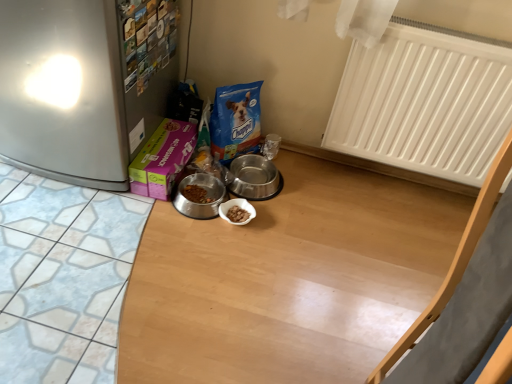
The height and width of the screenshot is (384, 512). What do you see at coordinates (207, 196) in the screenshot?
I see `metallic silver bowl at center, which is the 2th appliance from right to left` at bounding box center [207, 196].

Where is `matte purple box at center-left`? Image resolution: width=512 pixels, height=384 pixels. matte purple box at center-left is located at coordinates (162, 159).

The width and height of the screenshot is (512, 384). What do you see at coordinates (84, 85) in the screenshot?
I see `brushed metal fridge at left` at bounding box center [84, 85].

Image resolution: width=512 pixels, height=384 pixels. I want to click on brushed metal fridge at left, so click(x=84, y=85).

This screenshot has width=512, height=384. I want to click on white matte radiator at upper right, so click(x=424, y=102).

The image size is (512, 384). In order to click on metallic stainless steel bowl at center, which appears as the first appliance when viewed from the right in this screenshot , I will do `click(254, 177)`.

The width and height of the screenshot is (512, 384). I want to click on metallic silver bowl at center, which is the 2th appliance from right to left, so click(207, 196).

Is brushed metal fridge at left oriented towards white matte radiator at upper right?

No, brushed metal fridge at left does not turn towards white matte radiator at upper right.

Does brushed metal fridge at left have a lesser width compared to white matte radiator at upper right?

No, brushed metal fridge at left is not thinner than white matte radiator at upper right.

Considering the relative positions of brushed metal fridge at left and white matte radiator at upper right in the image provided, is brushed metal fridge at left behind white matte radiator at upper right?

No, it is in front of white matte radiator at upper right.

From the image's perspective, is brushed metal fridge at left beneath white matte radiator at upper right?

No, from the image's perspective, brushed metal fridge at left is not below white matte radiator at upper right.

Can you confirm if white matte radiator at upper right is positioned to the right of metallic stainless steel bowl at center, positioned as the 2th appliance in left-to-right order?

Correct, you'll find white matte radiator at upper right to the right of metallic stainless steel bowl at center, positioned as the 2th appliance in left-to-right order.

Considering the sizes of white matte radiator at upper right and metallic stainless steel bowl at center, which appears as the first appliance when viewed from the right, in the image, is white matte radiator at upper right wider or thinner than metallic stainless steel bowl at center, which appears as the first appliance when viewed from the right,?

In the image, white matte radiator at upper right appears to be more narrow than metallic stainless steel bowl at center, which appears as the first appliance when viewed from the right.

From a real-world perspective, between white matte radiator at upper right and metallic stainless steel bowl at center, which appears as the first appliance when viewed from the right, who is vertically higher?

From a 3D spatial view, white matte radiator at upper right is above.

Is white matte radiator at upper right touching metallic stainless steel bowl at center, which appears as the first appliance when viewed from the right?

No, white matte radiator at upper right is not with metallic stainless steel bowl at center, which appears as the first appliance when viewed from the right.

Is white matte radiator at upper right taller than metallic silver bowl at center, which is the 2th appliance from right to left?

Yes, white matte radiator at upper right is taller than metallic silver bowl at center, which is the 2th appliance from right to left.

Is point (384, 46) closer to viewer compared to point (204, 181)?

Yes, point (384, 46) is closer to viewer.

Considering the relative sizes of white matte radiator at upper right and metallic silver bowl at center, the 1th appliance viewed from the left, in the image provided, is white matte radiator at upper right bigger than metallic silver bowl at center, the 1th appliance viewed from the left,?

Indeed, white matte radiator at upper right has a larger size compared to metallic silver bowl at center, the 1th appliance viewed from the left.

Consider the image. In terms of height, does matte purple box at center-left look taller or shorter compared to metallic stainless steel bowl at center, which appears as the first appliance when viewed from the right?

matte purple box at center-left is taller than metallic stainless steel bowl at center, which appears as the first appliance when viewed from the right.

Looking at this image, considering the sizes of matte purple box at center-left and metallic stainless steel bowl at center, positioned as the 2th appliance in left-to-right order, in the image, is matte purple box at center-left wider or thinner than metallic stainless steel bowl at center, positioned as the 2th appliance in left-to-right order,?

Clearly, matte purple box at center-left has more width compared to metallic stainless steel bowl at center, positioned as the 2th appliance in left-to-right order.

Based on the photo, considering the relative sizes of matte purple box at center-left and metallic stainless steel bowl at center, which appears as the first appliance when viewed from the right, in the image provided, is matte purple box at center-left smaller than metallic stainless steel bowl at center, which appears as the first appliance when viewed from the right,?

Incorrect, matte purple box at center-left is not smaller in size than metallic stainless steel bowl at center, which appears as the first appliance when viewed from the right.

Is matte purple box at center-left inside or outside of metallic stainless steel bowl at center, positioned as the 2th appliance in left-to-right order?

matte purple box at center-left is spatially situated outside metallic stainless steel bowl at center, positioned as the 2th appliance in left-to-right order.

Is metallic silver bowl at center, which is the 2th appliance from right to left, facing towards white matte radiator at upper right?

No.

Is metallic silver bowl at center, which is the 2th appliance from right to left, behind white matte radiator at upper right?

Yes, the depth of metallic silver bowl at center, which is the 2th appliance from right to left, is greater than that of white matte radiator at upper right.

From the image's perspective, between metallic silver bowl at center, which is the 2th appliance from right to left, and white matte radiator at upper right, which one is located above?

white matte radiator at upper right.

Between metallic silver bowl at center, the 1th appliance viewed from the left, and white matte radiator at upper right, which one appears on the right side from the viewer's perspective?

Positioned to the right is white matte radiator at upper right.

Is white matte radiator at upper right oriented away from brushed metal fridge at left?

That's not correct — white matte radiator at upper right is not looking away from brushed metal fridge at left.

In the scene shown: Considering the relative sizes of white matte radiator at upper right and brushed metal fridge at left in the image provided, is white matte radiator at upper right thinner than brushed metal fridge at left?

Correct, the width of white matte radiator at upper right is less than that of brushed metal fridge at left.

What are the coordinates of `radiator behind the brushed metal fridge at left` in the screenshot? It's located at (424, 102).

Looking at this image, considering the relative sizes of metallic silver bowl at center, the 1th appliance viewed from the left, and brushed metal fridge at left in the image provided, is metallic silver bowl at center, the 1th appliance viewed from the left, smaller than brushed metal fridge at left?

Yes.

The image size is (512, 384). I want to click on fridge in front of the metallic silver bowl at center, which is the 2th appliance from right to left, so click(x=84, y=85).

Which is farther from the camera, (x=197, y=208) or (x=77, y=60)?

Point (x=197, y=208)

Where is `fridge below the white matte radiator at upper right (from a real-world perspective)`? This screenshot has width=512, height=384. fridge below the white matte radiator at upper right (from a real-world perspective) is located at coordinates (84, 85).

Locate an element on the screen. radiator above the metallic stainless steel bowl at center, which appears as the first appliance when viewed from the right (from the image's perspective) is located at coordinates (424, 102).

From the image, which object appears to be nearer to metallic stainless steel bowl at center, which appears as the first appliance when viewed from the right, matte purple box at center-left or white matte radiator at upper right?

Among the two, matte purple box at center-left is located nearer to metallic stainless steel bowl at center, which appears as the first appliance when viewed from the right.

When comparing their distances from white matte radiator at upper right, does metallic silver bowl at center, which is the 2th appliance from right to left, or matte purple box at center-left seem further?

matte purple box at center-left lies further to white matte radiator at upper right than the other object.

Based on their spatial positions, is matte purple box at center-left or white matte radiator at upper right further from brushed metal fridge at left?

white matte radiator at upper right.

When comparing their distances from metallic silver bowl at center, the 1th appliance viewed from the left, does white matte radiator at upper right or matte purple box at center-left seem closer?

Among the two, matte purple box at center-left is located nearer to metallic silver bowl at center, the 1th appliance viewed from the left.

Based on their spatial positions, is brushed metal fridge at left or metallic silver bowl at center, which is the 2th appliance from right to left, further from metallic stainless steel bowl at center, which appears as the first appliance when viewed from the right?

The object further to metallic stainless steel bowl at center, which appears as the first appliance when viewed from the right, is brushed metal fridge at left.

Which object lies nearer to the anchor point metallic stainless steel bowl at center, positioned as the 2th appliance in left-to-right order, matte purple box at center-left or brushed metal fridge at left?

Based on the image, matte purple box at center-left appears to be nearer to metallic stainless steel bowl at center, positioned as the 2th appliance in left-to-right order.

Which object lies further to the anchor point metallic stainless steel bowl at center, positioned as the 2th appliance in left-to-right order, matte purple box at center-left or metallic silver bowl at center, which is the 2th appliance from right to left?

Among the two, matte purple box at center-left is located further to metallic stainless steel bowl at center, positioned as the 2th appliance in left-to-right order.

In the scene shown: Estimate the real-world distances between objects in this image. Which object is closer to white matte radiator at upper right, matte purple box at center-left or metallic silver bowl at center, the 1th appliance viewed from the left?

metallic silver bowl at center, the 1th appliance viewed from the left, is positioned closer to the anchor white matte radiator at upper right.

The width and height of the screenshot is (512, 384). I want to click on box between brushed metal fridge at left and metallic stainless steel bowl at center, which appears as the first appliance when viewed from the right, so click(162, 159).

Find the location of a particular element. appliance between metallic silver bowl at center, which is the 2th appliance from right to left, and white matte radiator at upper right, in the horizontal direction is located at coordinates (254, 177).

Image resolution: width=512 pixels, height=384 pixels. I want to click on appliance situated between brushed metal fridge at left and metallic stainless steel bowl at center, positioned as the 2th appliance in left-to-right order, from left to right, so click(207, 196).

Locate an element on the screen. Image resolution: width=512 pixels, height=384 pixels. appliance between matte purple box at center-left and metallic stainless steel bowl at center, positioned as the 2th appliance in left-to-right order, from left to right is located at coordinates (207, 196).